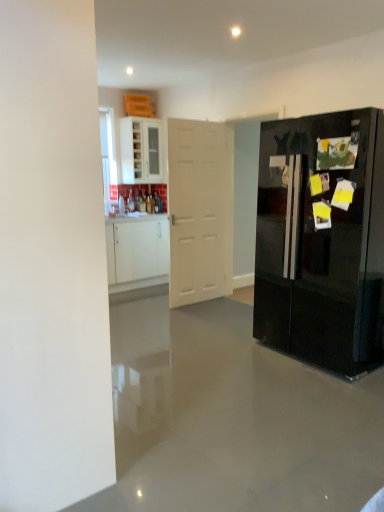
Question: Is white matte door at center wider than white glossy cabinet at upper left?

Choices:
 (A) yes
 (B) no

Answer: (B)

Question: Can you confirm if white matte door at center is positioned to the left of white glossy cabinet at upper left?

Choices:
 (A) no
 (B) yes

Answer: (A)

Question: Can you see white matte door at center touching white glossy cabinet at upper left?

Choices:
 (A) no
 (B) yes

Answer: (A)

Question: Is white matte door at center taller than white glossy cabinet at upper left?

Choices:
 (A) no
 (B) yes

Answer: (B)

Question: Is white matte door at center oriented towards white glossy cabinet at upper left?

Choices:
 (A) yes
 (B) no

Answer: (B)

Question: Does white matte door at center contain white glossy cabinet at upper left?

Choices:
 (A) yes
 (B) no

Answer: (B)

Question: Can you confirm if white glossy cabinet at upper left is bigger than white matte door at center?

Choices:
 (A) yes
 (B) no

Answer: (B)

Question: Is white glossy cabinet at upper left located outside white matte door at center?

Choices:
 (A) no
 (B) yes

Answer: (B)

Question: Are white glossy cabinet at upper left and white matte door at center located far from each other?

Choices:
 (A) no
 (B) yes

Answer: (B)

Question: Is white glossy cabinet at upper left facing away from white matte door at center?

Choices:
 (A) yes
 (B) no

Answer: (B)

Question: From a real-world perspective, is white glossy cabinet at upper left over white matte door at center?

Choices:
 (A) no
 (B) yes

Answer: (B)

Question: Is white glossy cabinet at upper left taller than white matte door at center?

Choices:
 (A) yes
 (B) no

Answer: (B)

Question: Could you tell me if glossy black refrigerator at right is turned towards white matte door at center?

Choices:
 (A) yes
 (B) no

Answer: (B)